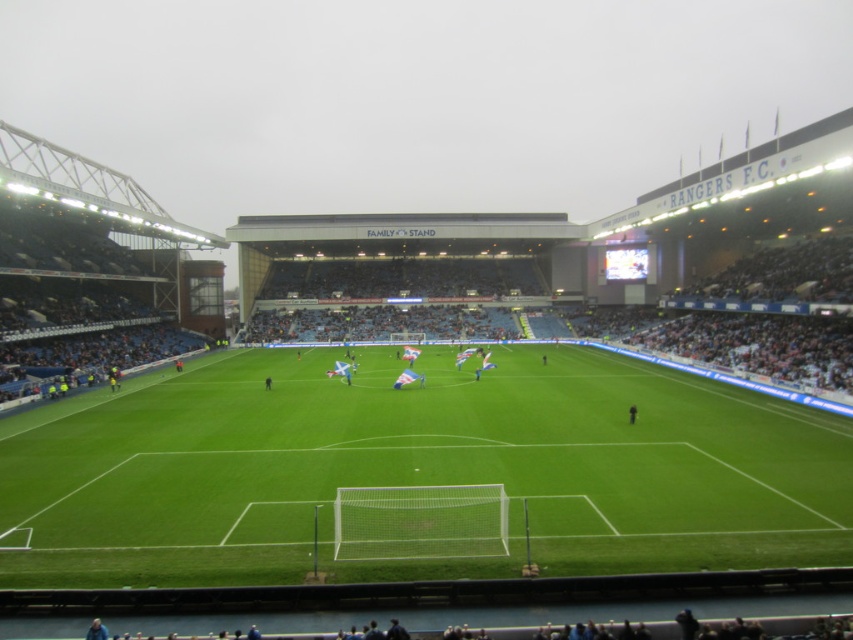
You are a photographer positioned at the edge of the field. You want to take a photo that includes both the green grass football field at center and the black fabric person at center. Which object will appear larger in the photo?

The green grass football field at center will appear larger in the photo because it is closer to the viewer than the black fabric person at center.

What are the coordinates of the green grass football field at center?

The green grass football field at center is located at coordinates point [419,468].